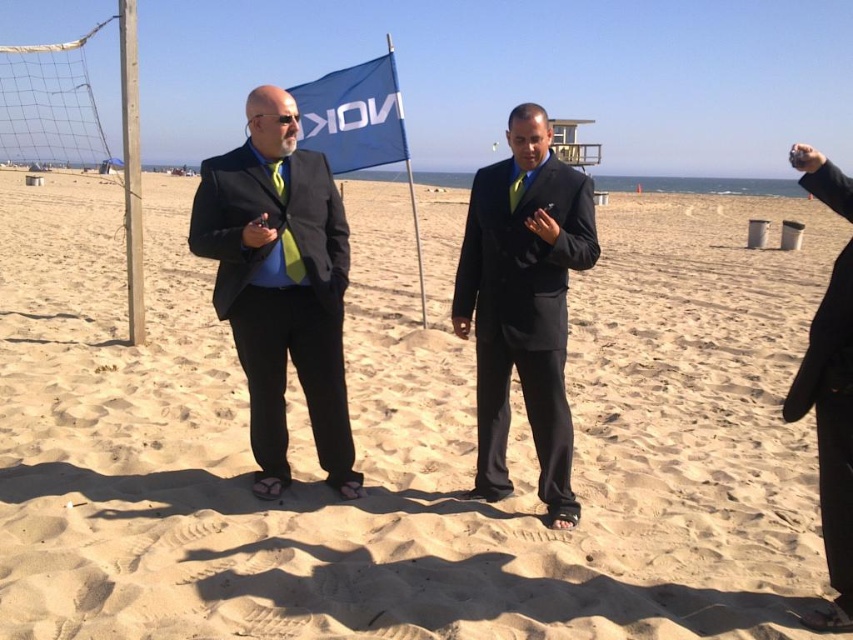
Question: Which is farther from the matte black suit at left?

Choices:
 (A) matte black suit at center
 (B) sandy beach at center

Answer: (B)

Question: Is sandy beach at center positioned at the back of black matte suit at right?

Choices:
 (A) no
 (B) yes

Answer: (B)

Question: Does sandy beach at center come in front of black matte suit at right?

Choices:
 (A) yes
 (B) no

Answer: (B)

Question: Which point is closer to the camera?

Choices:
 (A) blue fabric flag at center
 (B) matte black suit at center
 (C) black matte suit at right

Answer: (C)

Question: Which object appears closest to the camera in this image?

Choices:
 (A) blue fabric flag at center
 (B) matte black suit at center

Answer: (B)

Question: Is sandy beach at center to the left of matte black suit at left from the viewer's perspective?

Choices:
 (A) no
 (B) yes

Answer: (B)